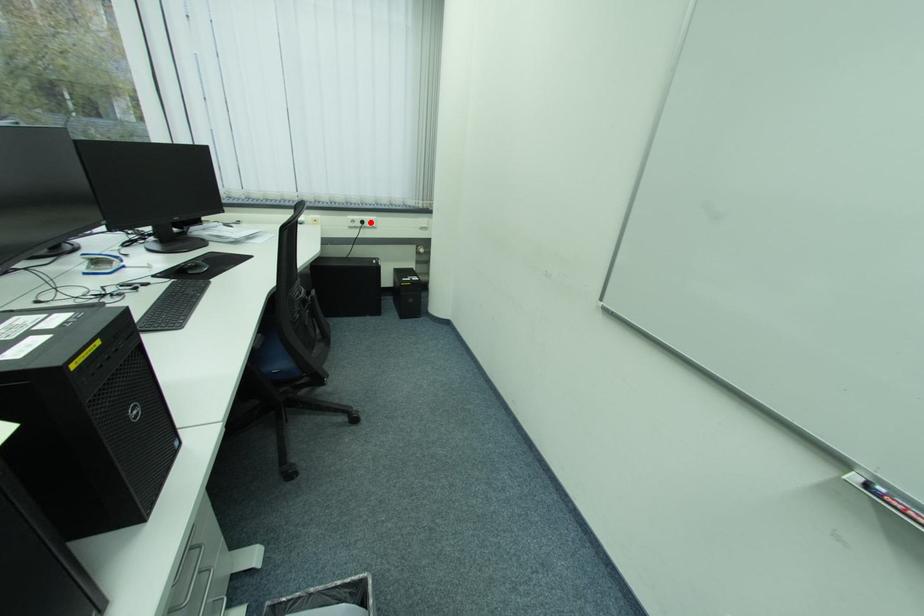
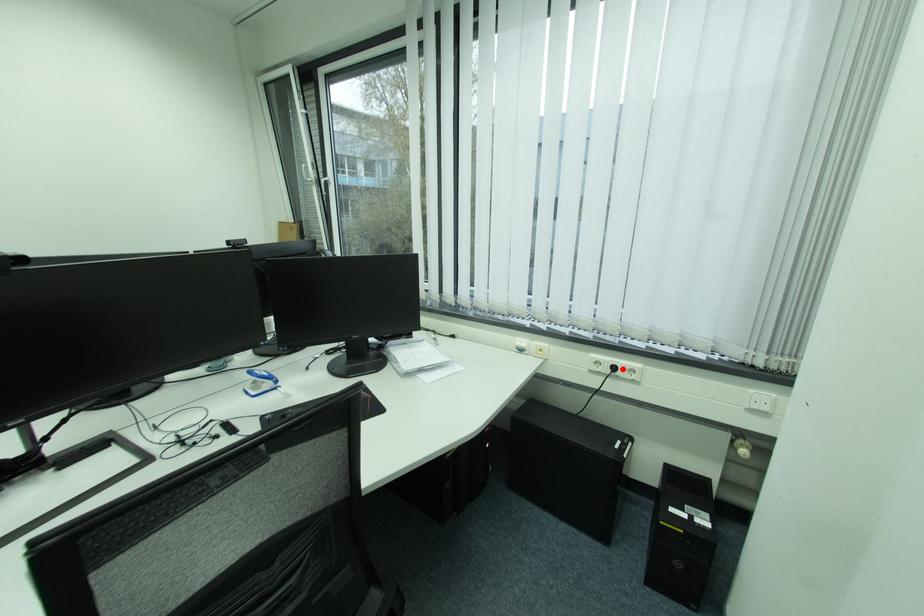
I am providing you with two images of the same scene from different viewpoints. A red point is marked on the first image and another point is marked on the second image. Is the red point in image1 aligned with the point shown in image2?

Yes